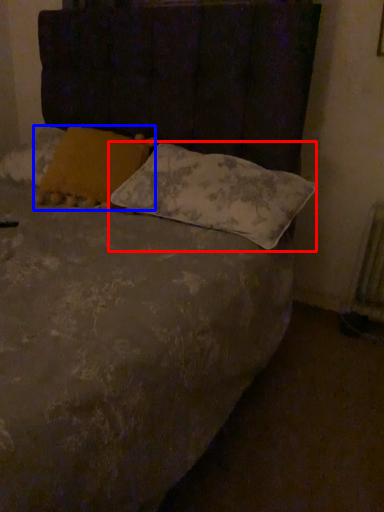
Question: Which of the following is the farthest to the observer, pillow (highlighted by a red box) or pillow (highlighted by a blue box)?

Choices:
 (A) pillow
 (B) pillow

Answer: (B)